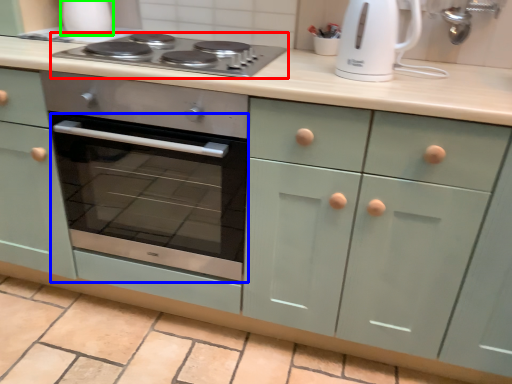
Question: Estimate the real-world distances between objects in this image. Which object is closer to gas stove (highlighted by a red box), oven (highlighted by a blue box) or appliance (highlighted by a green box)?

Choices:
 (A) oven
 (B) appliance

Answer: (B)